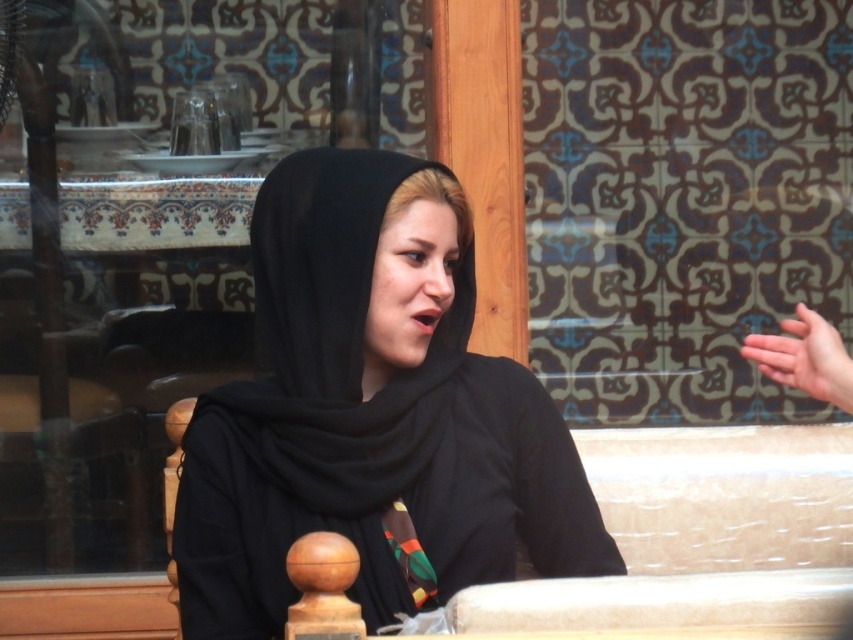
Question: Which point is closer to the camera taking this photo?

Choices:
 (A) [746, 356]
 (B) [396, 499]

Answer: (A)

Question: Is black matte headscarf at center to the left of smooth skin hand at right from the viewer's perspective?

Choices:
 (A) yes
 (B) no

Answer: (A)

Question: Among these points, which one is farthest from the camera?

Choices:
 (A) (450, 413)
 (B) (795, 314)

Answer: (B)

Question: Which point appears closest to the camera in this image?

Choices:
 (A) (819, 333)
 (B) (498, 358)

Answer: (A)

Question: Is the position of black matte headscarf at center less distant than that of smooth skin hand at right?

Choices:
 (A) no
 (B) yes

Answer: (A)

Question: Does black matte headscarf at center have a greater width compared to smooth skin hand at right?

Choices:
 (A) yes
 (B) no

Answer: (A)